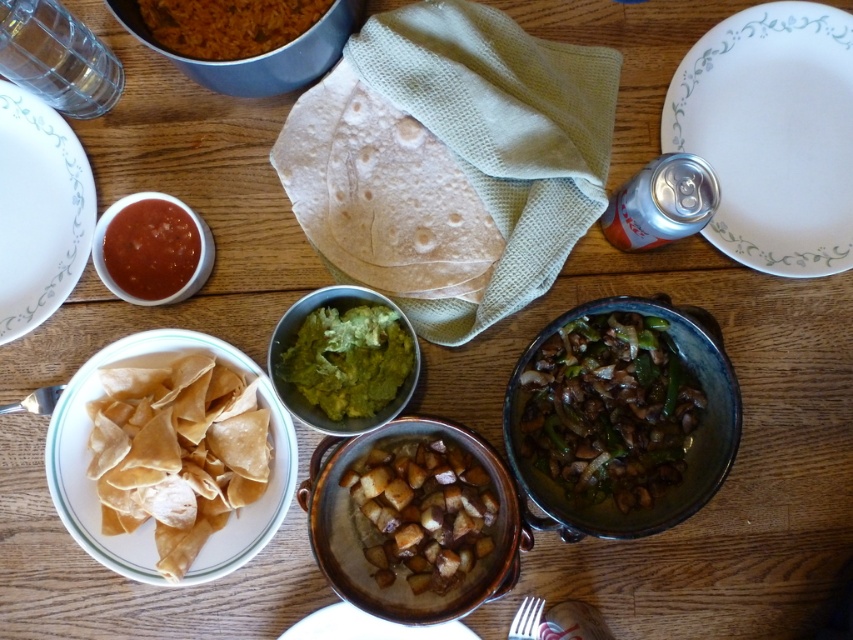
Locate an element on the screen. green glossy mushrooms at center right is located at coordinates (606, 410).

Is point (572, 360) positioned in front of point (273, 38)?

No, it is not.

Find the location of a particular element. green glossy mushrooms at center right is located at coordinates (606, 410).

Does point (753, 140) come farther from viewer compared to point (80, 260)?

Yes.

Is white ceramic plate at upper right in front of white ceramic plate at upper left?

No.

Find the location of a particular element. Image resolution: width=853 pixels, height=640 pixels. white ceramic plate at upper right is located at coordinates (772, 134).

What are the coordinates of `white ceramic plate at upper right` in the screenshot? It's located at (772, 134).

Which is below, green creamy guacamole at center or matte glass bowl at upper left?

green creamy guacamole at center

Between point (372, 316) and point (138, 228), which one is positioned in front?

Point (372, 316) is in front.

Measure the distance between point [364,358] and camera.

31.90 inches

Image resolution: width=853 pixels, height=640 pixels. Find the location of `green creamy guacamole at center`. green creamy guacamole at center is located at coordinates (347, 358).